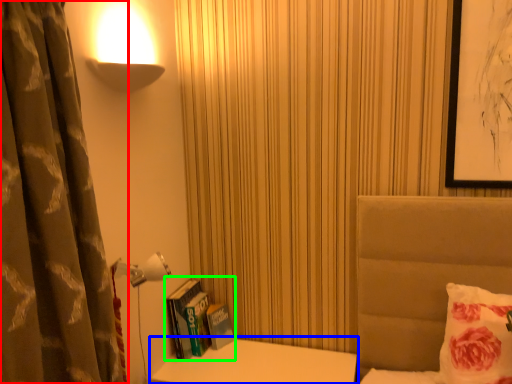
Question: Estimate the real-world distances between objects in this image. Which object is closer to curtain (highlighted by a red box), table (highlighted by a blue box) or book (highlighted by a green box)?

Choices:
 (A) table
 (B) book

Answer: (B)